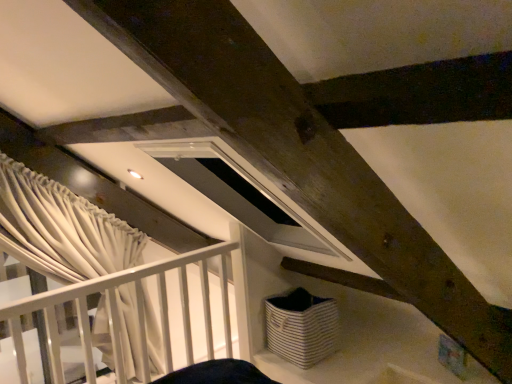
Question: From the image's perspective, is white matte rail at left on white textured curtain at left?

Choices:
 (A) yes
 (B) no

Answer: (B)

Question: Does white matte rail at left come behind white textured curtain at left?

Choices:
 (A) no
 (B) yes

Answer: (A)

Question: From a real-world perspective, is white matte rail at left over white textured curtain at left?

Choices:
 (A) yes
 (B) no

Answer: (B)

Question: Does white matte rail at left have a larger size compared to white textured curtain at left?

Choices:
 (A) yes
 (B) no

Answer: (A)

Question: Does white matte rail at left turn towards white textured curtain at left?

Choices:
 (A) no
 (B) yes

Answer: (A)

Question: Considering the relative positions of white matte rail at left and white textured curtain at left in the image provided, is white matte rail at left to the left of white textured curtain at left from the viewer's perspective?

Choices:
 (A) no
 (B) yes

Answer: (A)

Question: Can you confirm if white striped fabric basket at lower center is smaller than white matte rail at left?

Choices:
 (A) no
 (B) yes

Answer: (B)

Question: Considering the relative sizes of white striped fabric basket at lower center and white matte rail at left in the image provided, is white striped fabric basket at lower center bigger than white matte rail at left?

Choices:
 (A) no
 (B) yes

Answer: (A)

Question: Can you confirm if white striped fabric basket at lower center is positioned to the left of white matte rail at left?

Choices:
 (A) yes
 (B) no

Answer: (B)

Question: Is there a large distance between white striped fabric basket at lower center and white matte rail at left?

Choices:
 (A) yes
 (B) no

Answer: (B)

Question: From a real-world perspective, is white striped fabric basket at lower center over white matte rail at left?

Choices:
 (A) no
 (B) yes

Answer: (A)

Question: From a real-world perspective, does white striped fabric basket at lower center sit lower than white matte rail at left?

Choices:
 (A) no
 (B) yes

Answer: (B)

Question: From the image's perspective, does white matte rail at left appear lower than white striped fabric basket at lower center?

Choices:
 (A) yes
 (B) no

Answer: (B)